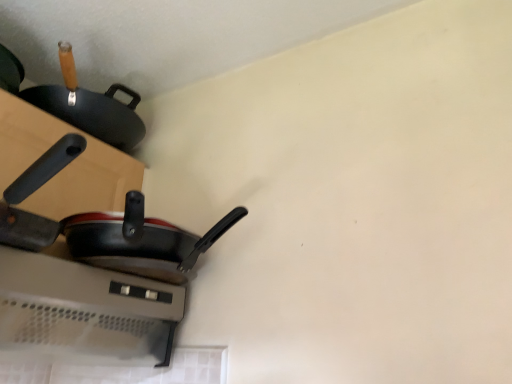
Question: Considering the relative sizes of black matte frying pan at left, acting as the second frying pan starting from the back, and black matte frying pan at lower left, positioned as the second frying pan in front-to-back order, in the image provided, is black matte frying pan at left, acting as the second frying pan starting from the back, shorter than black matte frying pan at lower left, positioned as the second frying pan in front-to-back order,?

Choices:
 (A) no
 (B) yes

Answer: (B)

Question: Is black matte frying pan at lower left, the 1th frying pan in the back-to-front sequence, at the back of black matte frying pan at left, the 1th frying pan viewed from the front?

Choices:
 (A) no
 (B) yes

Answer: (A)

Question: From a real-world perspective, is black matte frying pan at left, acting as the second frying pan starting from the back, physically below black matte frying pan at lower left, the 1th frying pan in the back-to-front sequence?

Choices:
 (A) yes
 (B) no

Answer: (A)

Question: Is black matte frying pan at left, acting as the second frying pan starting from the back, next to black matte frying pan at lower left, positioned as the second frying pan in front-to-back order, and touching it?

Choices:
 (A) yes
 (B) no

Answer: (B)

Question: Is the position of black matte frying pan at left, the 1th frying pan viewed from the front, more distant than that of black matte frying pan at lower left, the 1th frying pan in the back-to-front sequence?

Choices:
 (A) yes
 (B) no

Answer: (B)

Question: Can you confirm if black matte frying pan at left, the 1th frying pan viewed from the front, is smaller than black matte frying pan at lower left, positioned as the second frying pan in front-to-back order?

Choices:
 (A) yes
 (B) no

Answer: (A)

Question: Does black matte frying pan at lower left, positioned as the second frying pan in front-to-back order, have a lesser height compared to black matte frying pan at left, acting as the second frying pan starting from the back?

Choices:
 (A) no
 (B) yes

Answer: (A)

Question: Can you confirm if black matte frying pan at lower left, positioned as the second frying pan in front-to-back order, is wider than black matte frying pan at left, acting as the second frying pan starting from the back?

Choices:
 (A) yes
 (B) no

Answer: (A)

Question: Is black matte frying pan at lower left, the 1th frying pan in the back-to-front sequence, positioned far away from black matte frying pan at left, the 1th frying pan viewed from the front?

Choices:
 (A) yes
 (B) no

Answer: (B)

Question: Does black matte frying pan at lower left, the 1th frying pan in the back-to-front sequence, have a greater height compared to black matte frying pan at left, the 1th frying pan viewed from the front?

Choices:
 (A) no
 (B) yes

Answer: (B)

Question: Is black matte frying pan at lower left, positioned as the second frying pan in front-to-back order, not inside black matte frying pan at left, acting as the second frying pan starting from the back?

Choices:
 (A) yes
 (B) no

Answer: (A)

Question: Can you confirm if black matte frying pan at lower left, positioned as the second frying pan in front-to-back order, is positioned to the left of black matte frying pan at left, acting as the second frying pan starting from the back?

Choices:
 (A) yes
 (B) no

Answer: (B)

Question: Visually, is black matte frying pan at left, the 1th frying pan viewed from the front, positioned to the left or to the right of black matte frying pan at lower left, the 1th frying pan in the back-to-front sequence?

Choices:
 (A) right
 (B) left

Answer: (B)